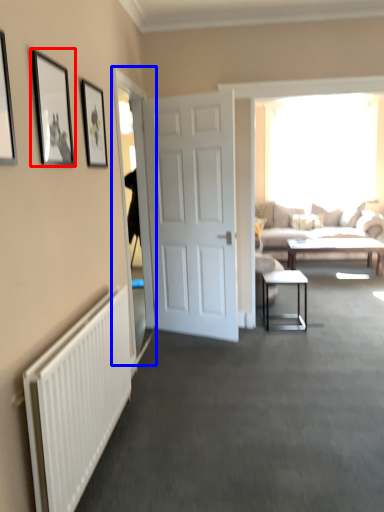
Question: Which of the following is the closest to the observer, picture frame (highlighted by a red box) or glass door (highlighted by a blue box)?

Choices:
 (A) picture frame
 (B) glass door

Answer: (A)